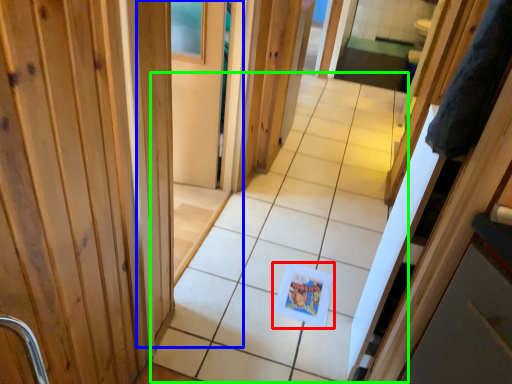
Question: Based on their relative distances, which object is nearer to postcard (highlighted by a red box)? Choose from barn door (highlighted by a blue box) and path (highlighted by a green box).

Choices:
 (A) barn door
 (B) path

Answer: (B)